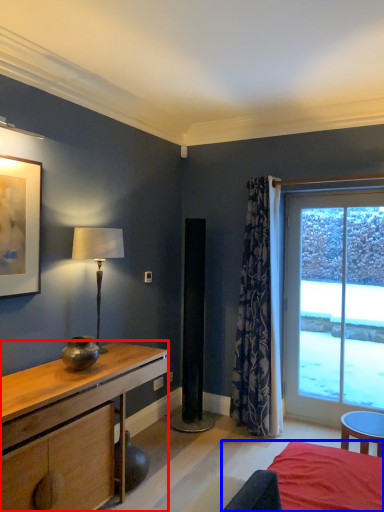
Question: Which object appears farthest to the camera in this image, desk (highlighted by a red box) or bed (highlighted by a blue box)?

Choices:
 (A) desk
 (B) bed

Answer: (A)